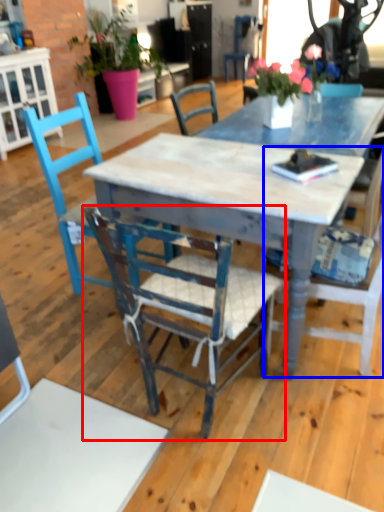
Question: Among these objects, which one is nearest to the camera, chair (highlighted by a red box) or chair (highlighted by a blue box)?

Choices:
 (A) chair
 (B) chair

Answer: (A)